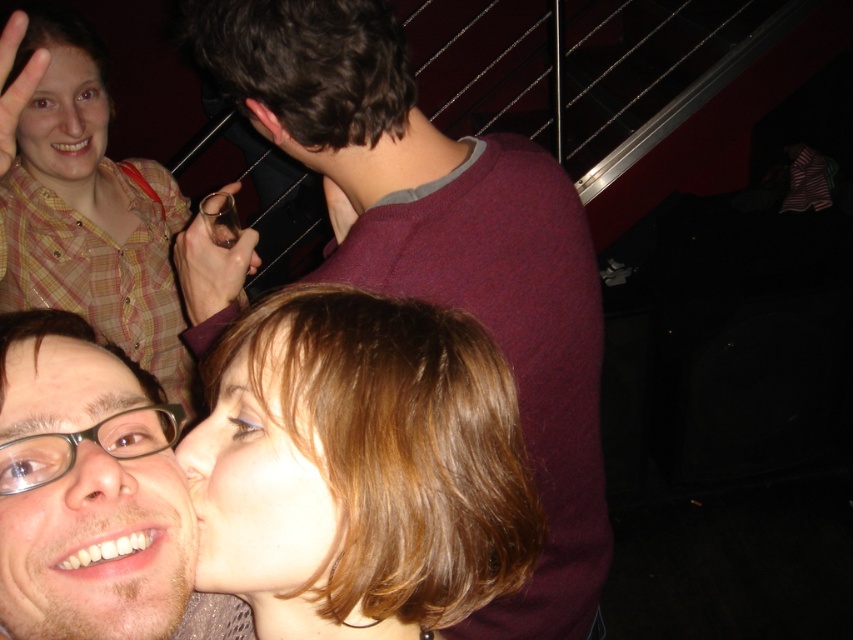
Can you confirm if maroon sweater at center is wider than glossy plastic face at lower left?

Correct, the width of maroon sweater at center exceeds that of glossy plastic face at lower left.

Which is above, maroon sweater at center or glossy plastic face at lower left?

Positioned higher is maroon sweater at center.

Is point (573, 192) closer to viewer compared to point (10, 516)?

No, (573, 192) is behind (10, 516).

Locate an element on the screen. maroon sweater at center is located at coordinates (442, 250).

Can you confirm if glossy plastic face at lower left is bigger than smooth skin face at lower center?

No.

Identify the location of glossy plastic face at lower left. This screenshot has height=640, width=853. (97, 548).

Is point (45, 532) in front of point (248, 600)?

Yes, point (45, 532) is closer to viewer.

Where is `glossy plastic face at lower left`? The height and width of the screenshot is (640, 853). glossy plastic face at lower left is located at coordinates (97, 548).

The width and height of the screenshot is (853, 640). Describe the element at coordinates (358, 467) in the screenshot. I see `shiny brown hair at center` at that location.

How distant is shiny brown hair at center from plaid shirt at upper left?

shiny brown hair at center is 3.47 feet away from plaid shirt at upper left.

Between point (442, 596) and point (100, 189), which one is positioned in front?

Point (442, 596) is more forward.

Image resolution: width=853 pixels, height=640 pixels. What are the coordinates of `shiny brown hair at center` in the screenshot? It's located at (358, 467).